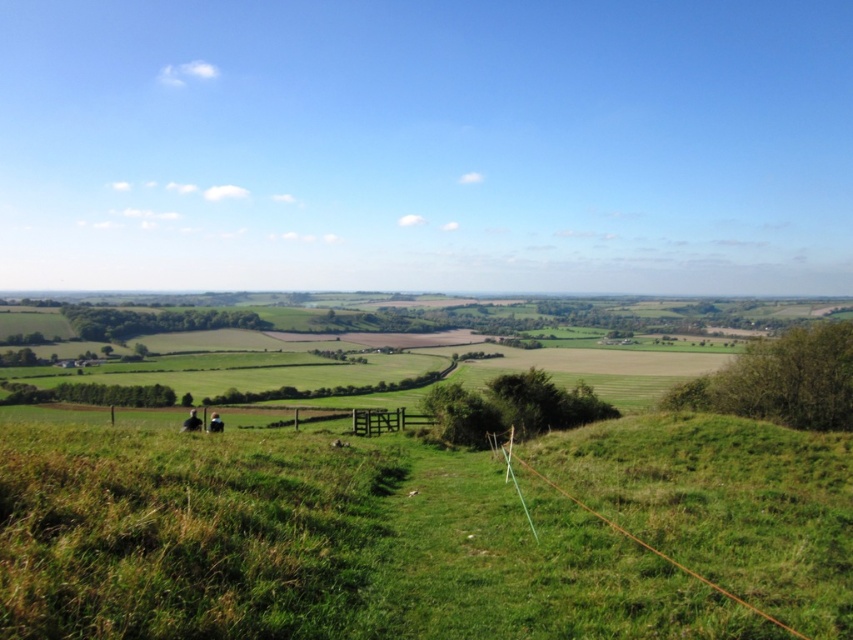
You are standing at the bottom of the green grassy hill at lower left and want to walk to the green wooden fence at center. Which direction should you head towards?

Since the green grassy hill at lower left is smaller in size compared to the green wooden fence at center, you should head towards the center direction to reach the green wooden fence at center from the green grassy hill at lower left.